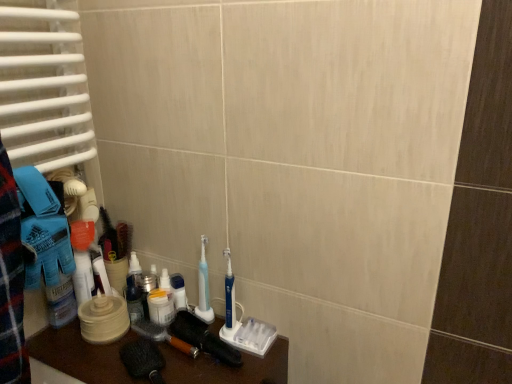
Identify the location of white plastic toothbrushes at lower left. [x=81, y=356].

The width and height of the screenshot is (512, 384). Identify the location of white glossy mouthwash at center. (161, 307).

This screenshot has width=512, height=384. Describe the element at coordinates (179, 291) in the screenshot. I see `white plastic container at center, the second toiletry viewed from the left` at that location.

Locate an element on the screen. This screenshot has height=384, width=512. blue plastic toothbrush at center, which ranks as the second toothbrush in left-to-right order is located at coordinates (229, 295).

This screenshot has height=384, width=512. Find the location of `white plastic toothbrushes at lower left`. white plastic toothbrushes at lower left is located at coordinates (81, 356).

From the image's perspective, is blue plastic toothbrush at center, acting as the first toothbrush starting from the right, on top of dark brown wooden brush at lower left, positioned as the 1th brush in left-to-right order?

Yes.

Is blue plastic toothbrush at center, which ranks as the second toothbrush in left-to-right order, oriented towards dark brown wooden brush at lower left, positioned as the 1th brush in left-to-right order?

No, blue plastic toothbrush at center, which ranks as the second toothbrush in left-to-right order, does not turn towards dark brown wooden brush at lower left, positioned as the 1th brush in left-to-right order.

The image size is (512, 384). Find the location of `the 1st toothbrush above when counting from the dark brown wooden brush at lower left, positioned as the 1th brush in left-to-right order (from the image's perspective)`. the 1st toothbrush above when counting from the dark brown wooden brush at lower left, positioned as the 1th brush in left-to-right order (from the image's perspective) is located at coordinates (229, 295).

Is dark brown wooden brush at lower left, which appears as the second brush when viewed from the right, oriented towards white glossy mouthwash at center?

No, dark brown wooden brush at lower left, which appears as the second brush when viewed from the right, does not turn towards white glossy mouthwash at center.

What's the angular difference between dark brown wooden brush at lower left, which appears as the second brush when viewed from the right, and white glossy mouthwash at center's facing directions?

There is a 9.63e-05-degree angle between the facing directions of dark brown wooden brush at lower left, which appears as the second brush when viewed from the right, and white glossy mouthwash at center.

From the image's perspective, which object appears higher, dark brown wooden brush at lower left, positioned as the 1th brush in left-to-right order, or white glossy mouthwash at center?

white glossy mouthwash at center.

Is point (177, 306) closer to camera compared to point (210, 316)?

No, it is not.

Does white plastic container at center, which is the 1th toiletry from right to left, contain blue plastic toothbrush at center, the 2th toothbrush in the right-to-left sequence?

Actually, blue plastic toothbrush at center, the 2th toothbrush in the right-to-left sequence, is outside white plastic container at center, which is the 1th toiletry from right to left.

From the image's perspective, is white plastic container at center, which is the 1th toiletry from right to left, located above blue plastic toothbrush at center, the first toothbrush positioned from the left?

No, from the image's perspective, white plastic container at center, which is the 1th toiletry from right to left, is not over blue plastic toothbrush at center, the first toothbrush positioned from the left.

Who is shorter, white plastic container at center, the second toiletry viewed from the left, or blue plastic toothbrush at center, the first toothbrush positioned from the left?

white plastic container at center, the second toiletry viewed from the left, is shorter.

Is blue plastic toothbrush at center, the 2th toothbrush in the right-to-left sequence, situated inside translucent plastic container at center, the 1th toiletry when ordered from left to right, or outside?

blue plastic toothbrush at center, the 2th toothbrush in the right-to-left sequence, is not enclosed by translucent plastic container at center, the 1th toiletry when ordered from left to right.

Is blue plastic toothbrush at center, the first toothbrush positioned from the left, facing towards translucent plastic container at center, which is the second toiletry in right-to-left order?

No, blue plastic toothbrush at center, the first toothbrush positioned from the left, is not oriented towards translucent plastic container at center, which is the second toiletry in right-to-left order.

From a real-world perspective, between blue plastic toothbrush at center, the 2th toothbrush in the right-to-left sequence, and translucent plastic container at center, the 1th toiletry when ordered from left to right, who is vertically lower?

translucent plastic container at center, the 1th toiletry when ordered from left to right, is physically lower.

Visually, is blue plastic toothbrush at center, the 2th toothbrush in the right-to-left sequence, positioned to the left or to the right of translucent plastic container at center, the 1th toiletry when ordered from left to right?

Clearly, blue plastic toothbrush at center, the 2th toothbrush in the right-to-left sequence, is on the right of translucent plastic container at center, the 1th toiletry when ordered from left to right, in the image.

You are a GUI agent. You are given a task and a screenshot of the screen. Output one action in this format:
    pyautogui.click(x=<x>, y=<y>)
    Task: Click on the mouthwash on the left of the white plastic container at center, the second toiletry viewed from the left
    The height and width of the screenshot is (384, 512).
    Given the screenshot: What is the action you would take?
    pyautogui.click(x=161, y=307)

Can you confirm if white glossy mouthwash at center is wider than white plastic container at center, the second toiletry viewed from the left?

Correct, the width of white glossy mouthwash at center exceeds that of white plastic container at center, the second toiletry viewed from the left.

Is white glossy mouthwash at center facing towards white plastic container at center, the second toiletry viewed from the left?

No.

Is translucent plastic container at center, the 1th toiletry when ordered from left to right, inside the boundaries of white plastic container at center, the second toiletry viewed from the left, or outside?

translucent plastic container at center, the 1th toiletry when ordered from left to right, is spatially situated outside white plastic container at center, the second toiletry viewed from the left.

How much distance is there between translucent plastic container at center, which is the second toiletry in right-to-left order, and white plastic container at center, which is the 1th toiletry from right to left?

They are 4.07 inches apart.

What's the angular difference between translucent plastic container at center, which is the second toiletry in right-to-left order, and white plastic container at center, which is the 1th toiletry from right to left,'s facing directions?

0.000286 degrees.

You are a GUI agent. You are given a task and a screenshot of the screen. Output one action in this format:
    pyautogui.click(x=<x>, y=<y>)
    Task: Click on the toiletry lying on the right of translucent plastic container at center, the 1th toiletry when ordered from left to right
    This screenshot has height=384, width=512.
    Given the screenshot: What is the action you would take?
    pyautogui.click(x=179, y=291)

From a real-world perspective, which is physically below, white plastic radiator at left or black rubber brush at lower center, the second brush in the left-to-right sequence?

black rubber brush at lower center, the second brush in the left-to-right sequence, from a real-world perspective.

Is the position of white plastic radiator at left more distant than that of black rubber brush at lower center, the second brush in the left-to-right sequence?

No, the depth of white plastic radiator at left is less than that of black rubber brush at lower center, the second brush in the left-to-right sequence.

Is black rubber brush at lower center, the second brush in the left-to-right sequence, a part of white plastic radiator at left?

That's incorrect, black rubber brush at lower center, the second brush in the left-to-right sequence, is not inside white plastic radiator at left.

Is white plastic radiator at left facing towards black rubber brush at lower center, which appears as the first brush when viewed from the right?

No, white plastic radiator at left does not turn towards black rubber brush at lower center, which appears as the first brush when viewed from the right.

Locate an element on the screen. The image size is (512, 384). the 2nd brush below when counting from the blue plastic toothbrush at center, acting as the first toothbrush starting from the right (from the image's perspective) is located at coordinates (163, 336).

Locate an element on the screen. This screenshot has width=512, height=384. mouthwash located on the left of dark brown wooden brush at lower left, which appears as the second brush when viewed from the right is located at coordinates (161, 307).

Which object lies further to the anchor point dark brown wooden brush at lower left, which appears as the second brush when viewed from the right, white plastic radiator at left or white plastic container at center, the second toiletry viewed from the left?

white plastic radiator at left is further to dark brown wooden brush at lower left, which appears as the second brush when viewed from the right.

From the image, which object appears to be nearer to blue plastic toothbrush at center, acting as the first toothbrush starting from the right, white glossy mouthwash at center or white plastic radiator at left?

white glossy mouthwash at center is closer to blue plastic toothbrush at center, acting as the first toothbrush starting from the right.

Consider the image. Considering their positions, is black rubber brush at lower center, which appears as the first brush when viewed from the right, positioned closer to white plastic radiator at left than blue plastic toothbrush at center, the first toothbrush positioned from the left?

blue plastic toothbrush at center, the first toothbrush positioned from the left, lies closer to white plastic radiator at left than the other object.

Consider the image. Estimate the real-world distances between objects in this image. Which object is further from white plastic radiator at left, translucent plastic container at center, the 1th toiletry when ordered from left to right, or blue plastic toothbrush at center, acting as the first toothbrush starting from the right?

The object further to white plastic radiator at left is blue plastic toothbrush at center, acting as the first toothbrush starting from the right.

When comparing their distances from blue plastic toothbrush at center, the first toothbrush positioned from the left, does white plastic toothbrushes at lower left or white plastic radiator at left seem closer?

white plastic toothbrushes at lower left is closer to blue plastic toothbrush at center, the first toothbrush positioned from the left.

Based on their spatial positions, is white plastic radiator at left or white plastic toothbrushes at lower left closer to dark brown wooden brush at lower left, which appears as the second brush when viewed from the right?

white plastic toothbrushes at lower left lies closer to dark brown wooden brush at lower left, which appears as the second brush when viewed from the right, than the other object.

In the scene shown: Which object lies nearer to the anchor point translucent plastic container at center, which is the second toiletry in right-to-left order, white plastic radiator at left or blue plastic toothbrush at center, which ranks as the second toothbrush in left-to-right order?

blue plastic toothbrush at center, which ranks as the second toothbrush in left-to-right order, is positioned closer to the anchor translucent plastic container at center, which is the second toiletry in right-to-left order.

When comparing their distances from white plastic toothbrushes at lower left, does black rubber brush at lower center, the second brush in the left-to-right sequence, or white glossy mouthwash at center seem further?

white glossy mouthwash at center is positioned further to the anchor white plastic toothbrushes at lower left.

This screenshot has width=512, height=384. I want to click on mouthwash between translucent plastic container at center, which is the second toiletry in right-to-left order, and blue plastic toothbrush at center, which ranks as the second toothbrush in left-to-right order, from left to right, so click(161, 307).

The height and width of the screenshot is (384, 512). Find the location of `brush located between black rubber brush at lower center, the second brush in the left-to-right sequence, and white plastic container at center, which is the 1th toiletry from right to left, in the depth direction`. brush located between black rubber brush at lower center, the second brush in the left-to-right sequence, and white plastic container at center, which is the 1th toiletry from right to left, in the depth direction is located at coordinates (163, 336).

Locate an element on the screen. The width and height of the screenshot is (512, 384). toiletry between white plastic radiator at left and translucent plastic container at center, which is the second toiletry in right-to-left order, in the vertical direction is located at coordinates (179, 291).

At what (x,y) coordinates should I click in order to perform the action: click on toothbrush between white plastic radiator at left and blue plastic toothbrush at center, which ranks as the second toothbrush in left-to-right order, in the up-down direction. Please return your answer as a coordinate pair (x, y). Looking at the image, I should click on (204, 288).